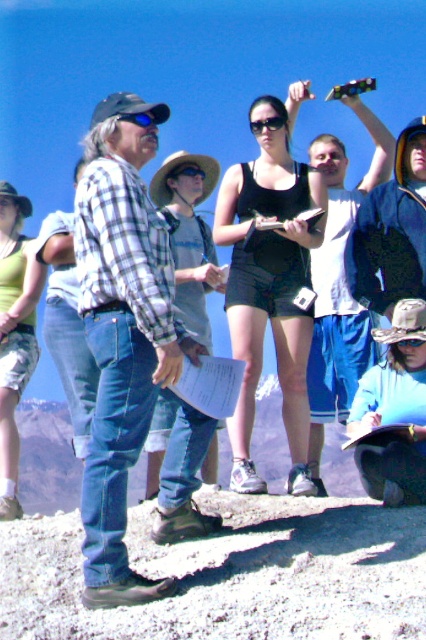
Question: Which point appears farthest from the camera in this image?

Choices:
 (A) (25, 244)
 (B) (373, 404)
 (C) (265, 173)

Answer: (A)

Question: Is blue denim jeans at lower center smaller than camouflage shorts at center?

Choices:
 (A) no
 (B) yes

Answer: (B)

Question: Which object is positioned farthest from the camouflage shorts at center?

Choices:
 (A) black tank top at center
 (B) blue denim jeans at lower center

Answer: (B)

Question: Is blue denim jeans at lower center further to camera compared to camouflage shorts at center?

Choices:
 (A) yes
 (B) no

Answer: (B)

Question: Which is farther from the camouflage shorts at center?

Choices:
 (A) black tank top at center
 (B) blue denim jeans at lower center

Answer: (B)

Question: Can you confirm if blue denim jeans at lower center is positioned below camouflage shorts at center?

Choices:
 (A) no
 (B) yes

Answer: (B)